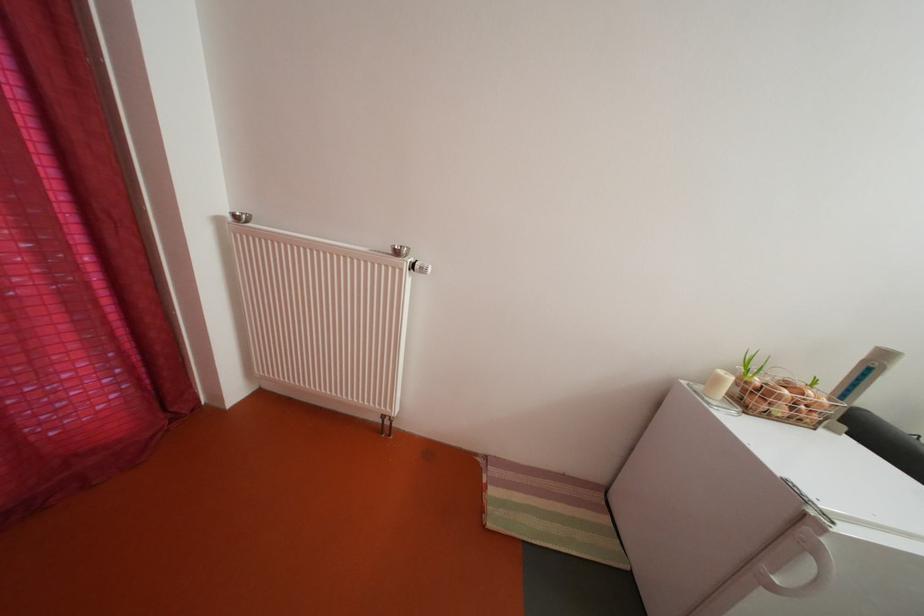
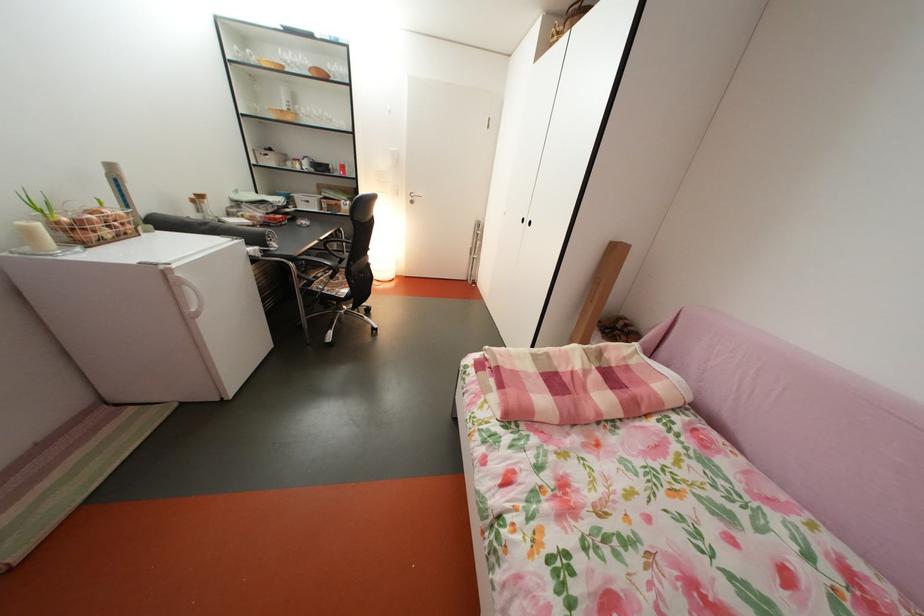
Locate, in the second image, the point that corresponds to pixel 823 517 in the first image.

(174, 274)